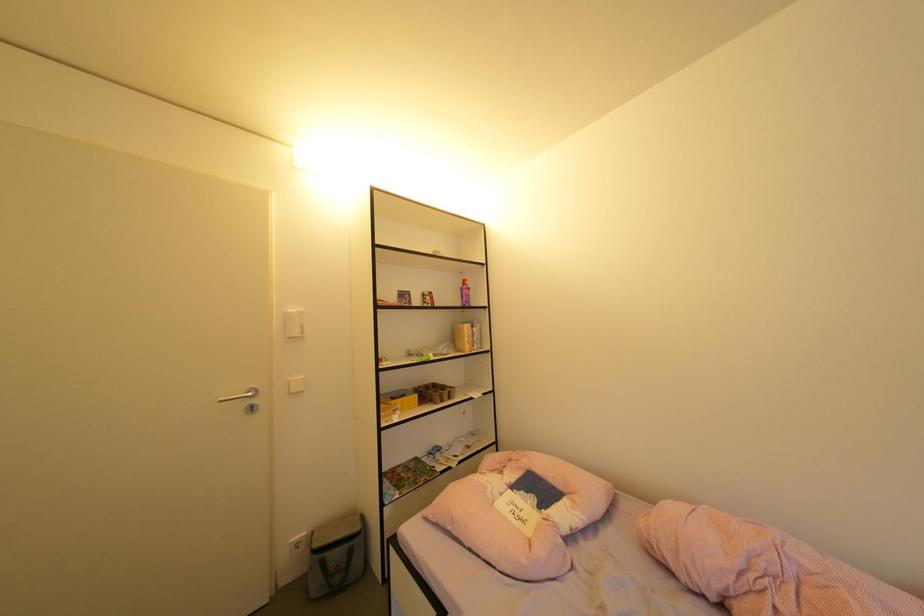
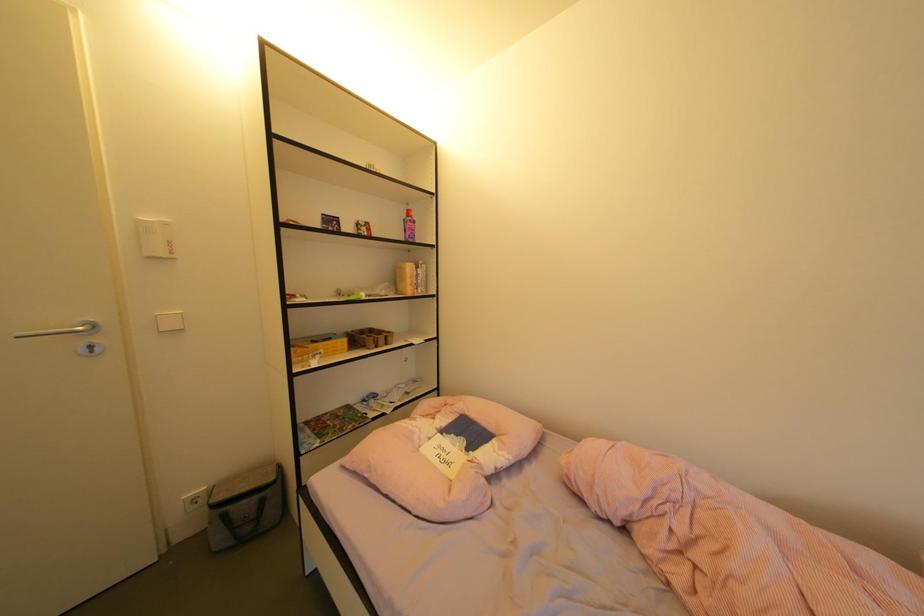
Question: The first image is from the beginning of the video and the second image is from the end. How did the camera likely rotate when shooting the video?

Choices:
 (A) Left
 (B) Right
 (C) Up
 (D) Down

Answer: (D)